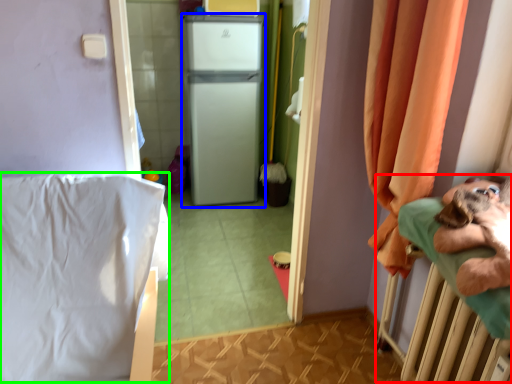
Question: Estimate the real-world distances between objects in this image. Which object is farther from hospital bed (highlighted by a red box), appliance (highlighted by a blue box) or sheet (highlighted by a green box)?

Choices:
 (A) appliance
 (B) sheet

Answer: (A)